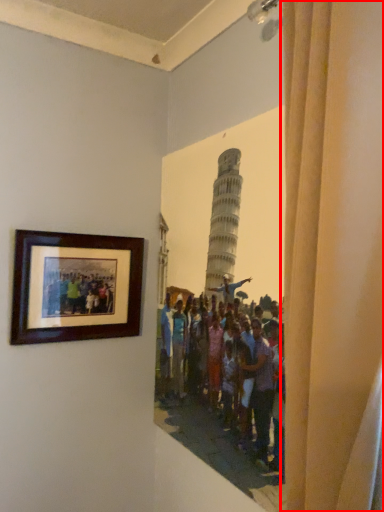
Question: From the image's perspective, where is curtain (annotated by the red box) located in relation to picture frame in the image?

Choices:
 (A) below
 (B) above

Answer: (B)